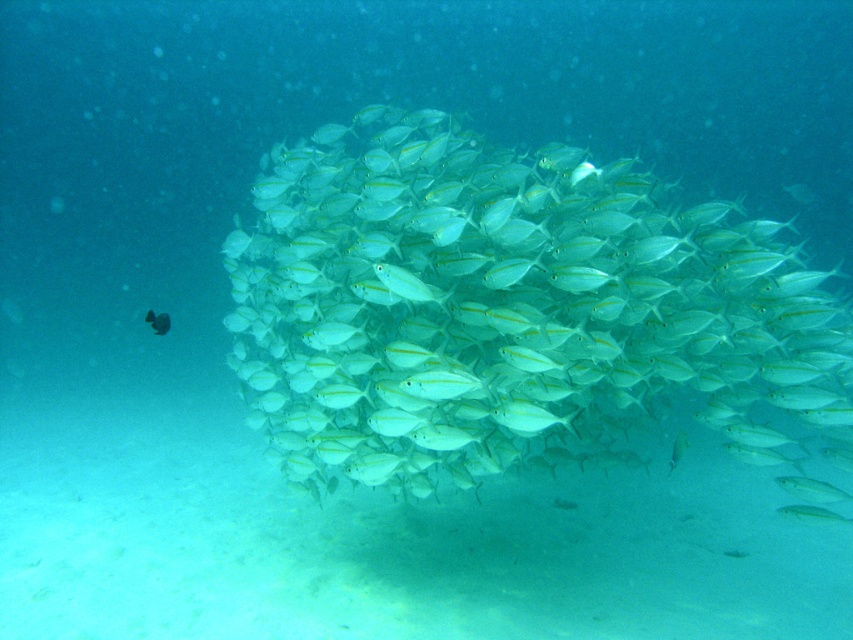
Between translucent white fish at center and shiny silver fish at center, which one is positioned higher?

shiny silver fish at center is above.

Who is more distant from viewer, (695, 413) or (158, 326)?

The point (158, 326) is behind.

Between point (445, 330) and point (160, 330), which one is positioned in front?

Point (445, 330)

Locate an element on the screen. The image size is (853, 640). translucent white fish at center is located at coordinates (505, 307).